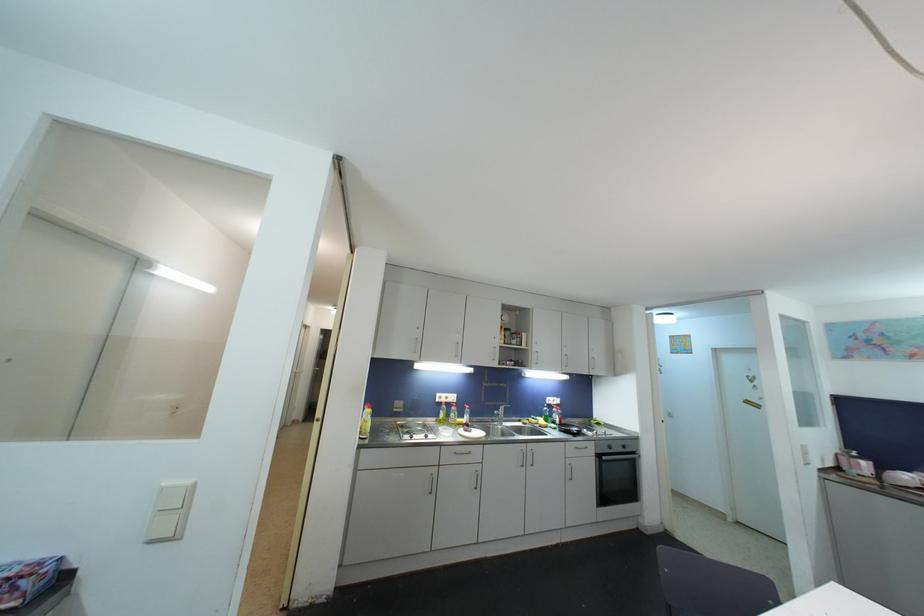
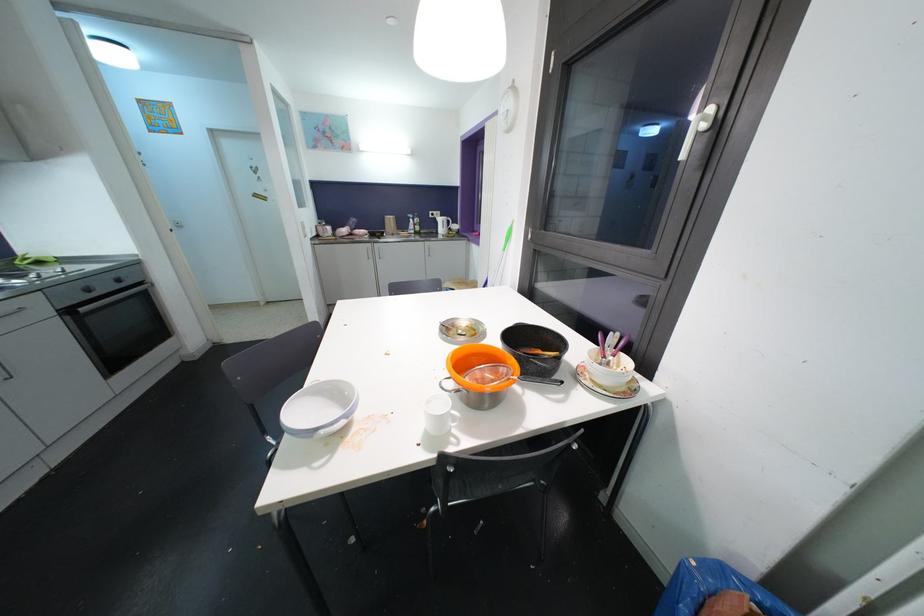
Find the pixel in the second image that matches point (606, 460) in the first image.

(84, 312)